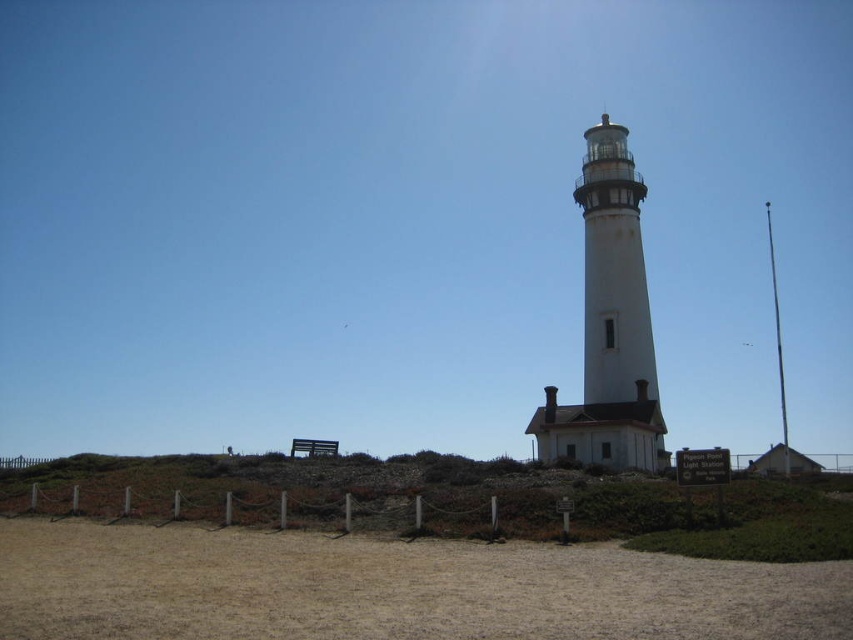
Between brown sandy ground at lower center and white stone lighthouse at center, which one appears on the right side from the viewer's perspective?

Positioned to the right is white stone lighthouse at center.

Who is lower down, brown sandy ground at lower center or white stone lighthouse at center?

brown sandy ground at lower center is lower down.

Locate an element on the screen. Image resolution: width=853 pixels, height=640 pixels. brown sandy ground at lower center is located at coordinates (392, 588).